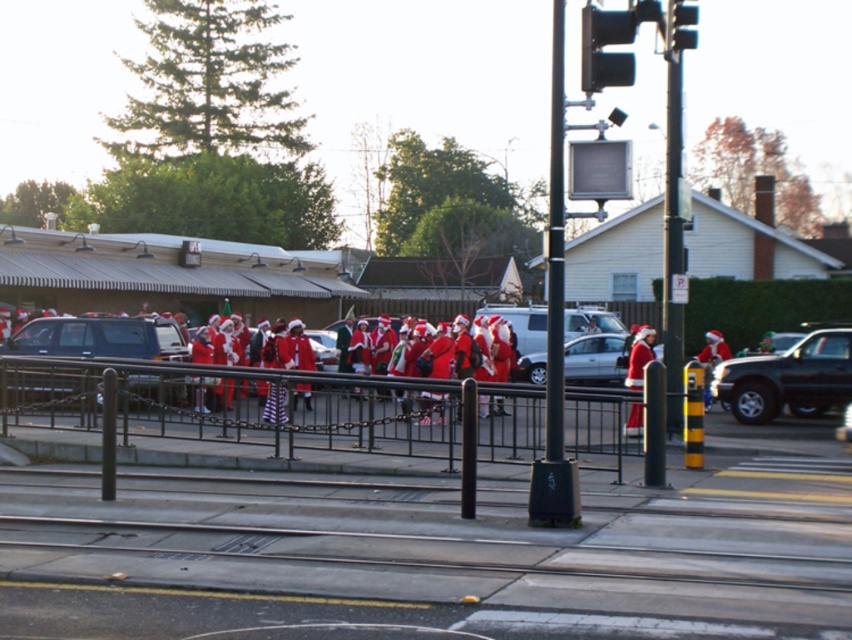
Is silver metallic sedan at center below matte red santa suit at center?

Incorrect, silver metallic sedan at center is not positioned below matte red santa suit at center.

Looking at this image, who is higher up, silver metallic sedan at center or matte red santa suit at center?

silver metallic sedan at center is higher up.

Which is in front, point (530, 371) or point (642, 339)?

Positioned in front is point (642, 339).

At what (x,y) coordinates should I click in order to perform the action: click on silver metallic sedan at center. Please return your answer as a coordinate pair (x, y). The width and height of the screenshot is (852, 640). Looking at the image, I should click on (596, 356).

Who is lower down, matte red santa suit at center or black plastic traffic light at upper right?

matte red santa suit at center is lower down.

Is point (642, 362) positioned after point (672, 36)?

Yes, it is behind point (672, 36).

The width and height of the screenshot is (852, 640). What do you see at coordinates (639, 356) in the screenshot? I see `matte red santa suit at center` at bounding box center [639, 356].

Find the location of a particular element. The height and width of the screenshot is (640, 852). matte red santa suit at center is located at coordinates (639, 356).

How much distance is there between shiny black truck at right and silver metallic sedan at center?

shiny black truck at right is 3.30 meters from silver metallic sedan at center.

How distant is shiny black truck at right from silver metallic sedan at center?

A distance of 3.30 meters exists between shiny black truck at right and silver metallic sedan at center.

The width and height of the screenshot is (852, 640). What do you see at coordinates (787, 378) in the screenshot?
I see `shiny black truck at right` at bounding box center [787, 378].

You are a GUI agent. You are given a task and a screenshot of the screen. Output one action in this format:
    pyautogui.click(x=<x>, y=<y>)
    Task: Click on the shiny black truck at right
    Image resolution: width=852 pixels, height=640 pixels.
    Given the screenshot: What is the action you would take?
    pyautogui.click(x=787, y=378)